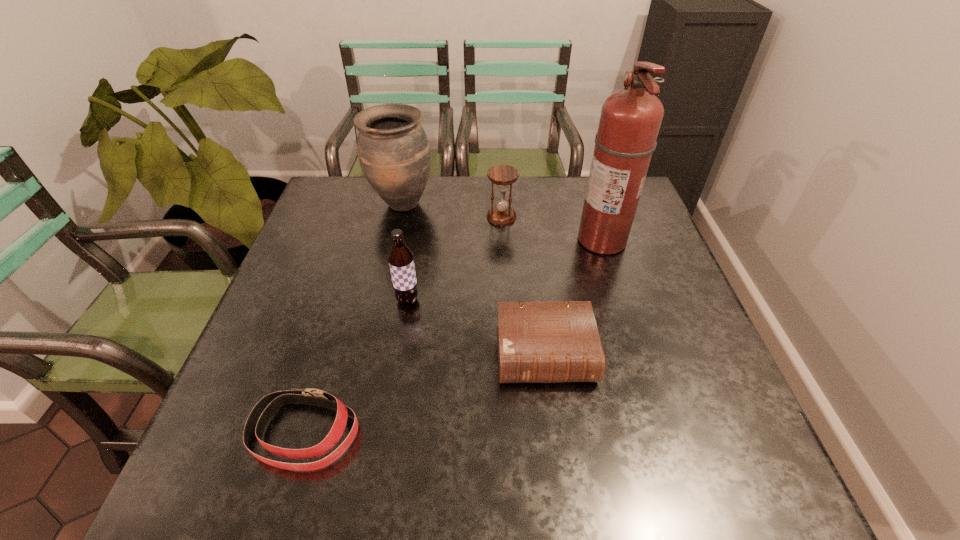
Where is `free space between the rightmost object and the second shortest object`? Image resolution: width=960 pixels, height=540 pixels. free space between the rightmost object and the second shortest object is located at coordinates (573, 298).

Locate which object ranks in proximity to the second nearest object. Please provide its 2D coordinates. Your answer should be formatted as a tuple, i.e. [(x, y)], where the tuple contains the x and y coordinates of a point satisfying the conditions above.

[(401, 259)]

Locate an element on the screen. Image resolution: width=960 pixels, height=540 pixels. the fourth closest object to the urn is located at coordinates (557, 341).

Image resolution: width=960 pixels, height=540 pixels. In order to click on free space that satisfies the following two spatial constraints: 1. on the front side of the urn; 2. on the right side of the third tallest object in this screenshot , I will do `click(380, 300)`.